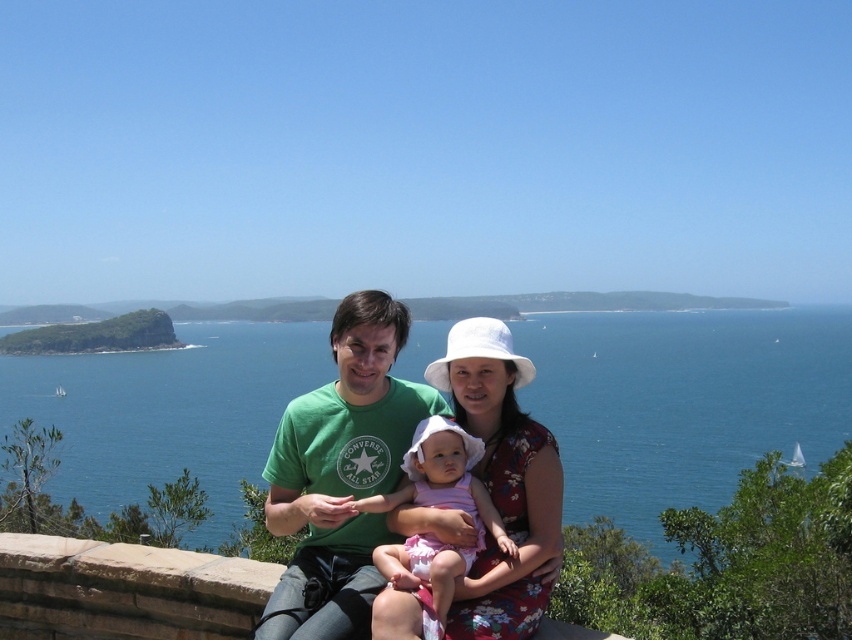
Is blue water at center smaller than green cotton t-shirt at center?

Incorrect, blue water at center is not smaller in size than green cotton t-shirt at center.

This screenshot has height=640, width=852. I want to click on blue water at center, so [x=683, y=403].

You are a GUI agent. You are given a task and a screenshot of the screen. Output one action in this format:
    pyautogui.click(x=<x>, y=<y>)
    Task: Click on the blue water at center
    
    Given the screenshot: What is the action you would take?
    pyautogui.click(x=683, y=403)

Can you confirm if floral fabric dress at center is wider than pink fabric dress at center?

Indeed, floral fabric dress at center has a greater width compared to pink fabric dress at center.

Between point (516, 506) and point (448, 474), which one is positioned in front?

Point (448, 474)

Image resolution: width=852 pixels, height=640 pixels. What are the coordinates of `floral fabric dress at center` in the screenshot? It's located at tap(502, 481).

Locate an element on the screen. The width and height of the screenshot is (852, 640). floral fabric dress at center is located at coordinates (502, 481).

Who is more distant from viewer, (x=358, y=464) or (x=484, y=369)?

Positioned behind is point (x=484, y=369).

Is green cotton t-shirt at center positioned at the back of floral fabric dress at center?

No, green cotton t-shirt at center is in front of floral fabric dress at center.

Who is more forward, (304, 458) or (432, 365)?

Point (304, 458)

Where is `green cotton t-shirt at center`? This screenshot has width=852, height=640. green cotton t-shirt at center is located at coordinates (341, 474).